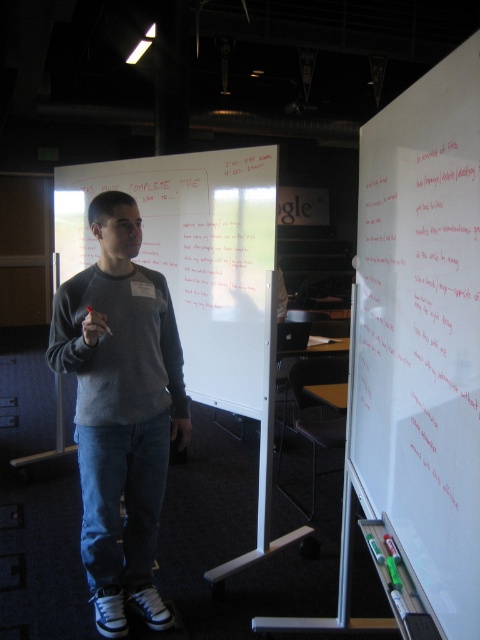
Question: Can you confirm if white matte whiteboard at right is positioned below white matte whiteboard at center?

Choices:
 (A) yes
 (B) no

Answer: (A)

Question: Which point is farther from the camera taking this photo?

Choices:
 (A) (208, 358)
 (B) (104, 413)

Answer: (A)

Question: Which point is closer to the camera?

Choices:
 (A) white matte whiteboard at center
 (B) gray matte sweater at center

Answer: (B)

Question: Does white matte whiteboard at right have a lesser width compared to white matte whiteboard at center?

Choices:
 (A) no
 (B) yes

Answer: (B)

Question: Which object is farther from the camera taking this photo?

Choices:
 (A) gray matte sweater at center
 (B) white matte whiteboard at right
 (C) white matte whiteboard at center

Answer: (C)

Question: Does white matte whiteboard at right have a greater width compared to white matte whiteboard at center?

Choices:
 (A) no
 (B) yes

Answer: (A)